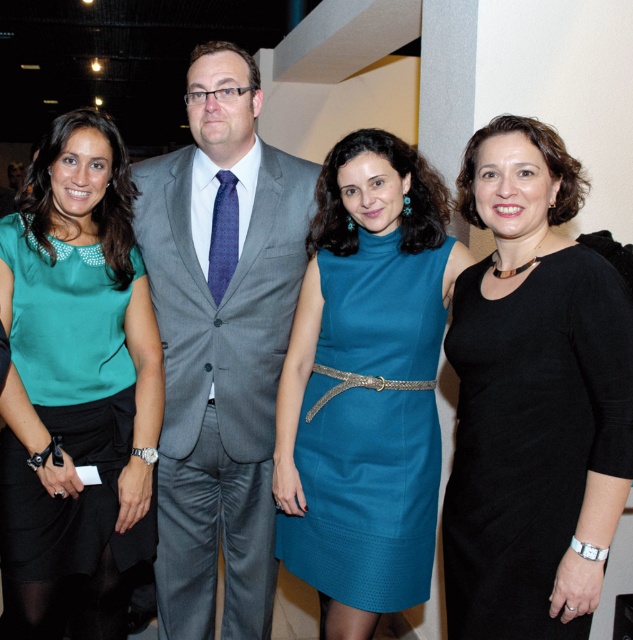
You are a photographer setting up for a group photo. You want to ensure that the black knit dress at right and the teal fabric dress at center are both visible in the frame. Given their heights, which dress might require you to adjust the camera angle to capture it properly?

The black knit dress at right has a lesser height compared to the teal fabric dress at center, so you might need to lower the camera angle slightly to ensure the shorter dress is fully visible in the frame.